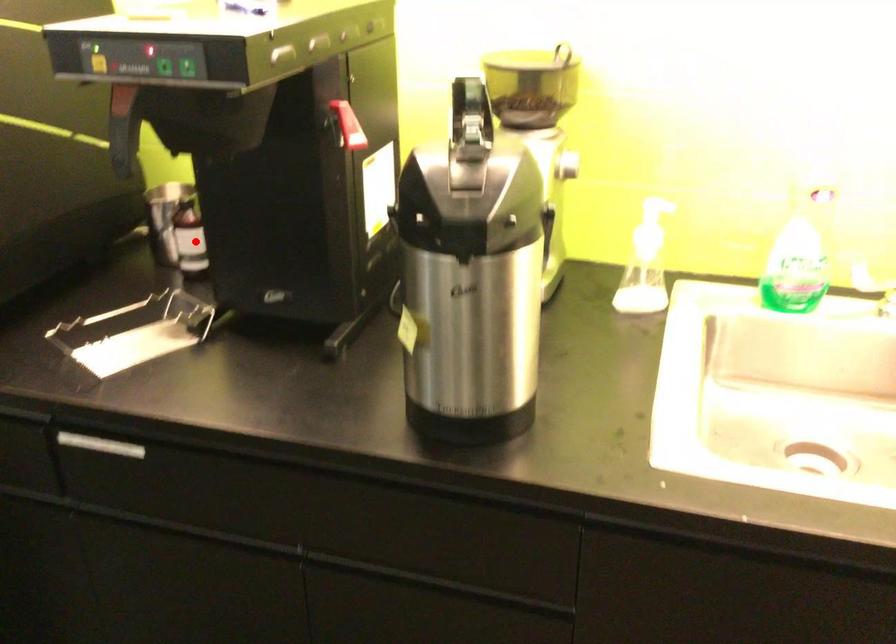
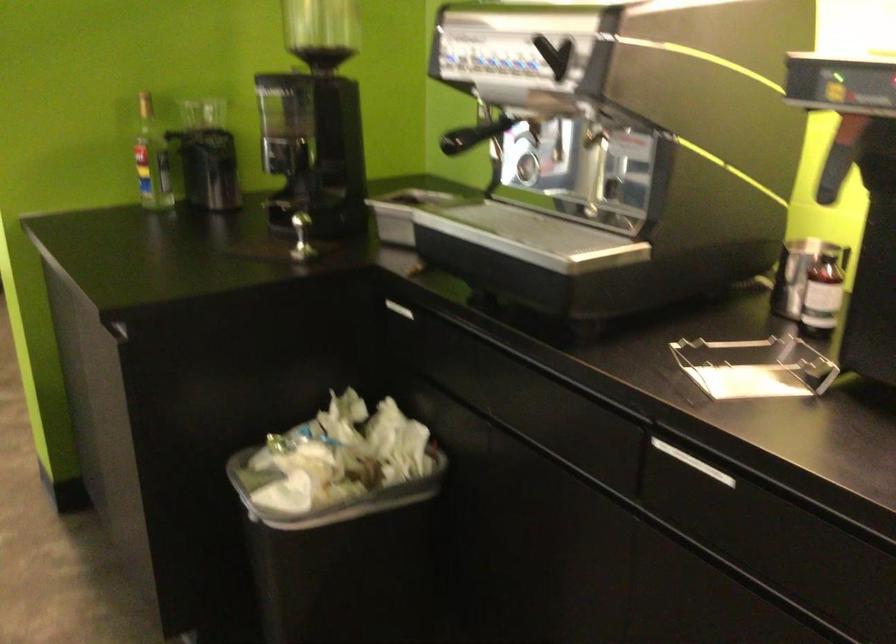
Locate, in the second image, the point that corresponds to the highlighted location in the first image.

(822, 294)